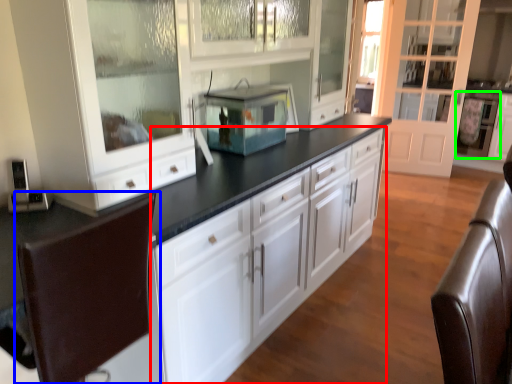
Question: Which object is the farthest from cabinetry (highlighted by a red box)? Choose among these: swivel chair (highlighted by a blue box) or appliance (highlighted by a green box).

Choices:
 (A) swivel chair
 (B) appliance

Answer: (B)